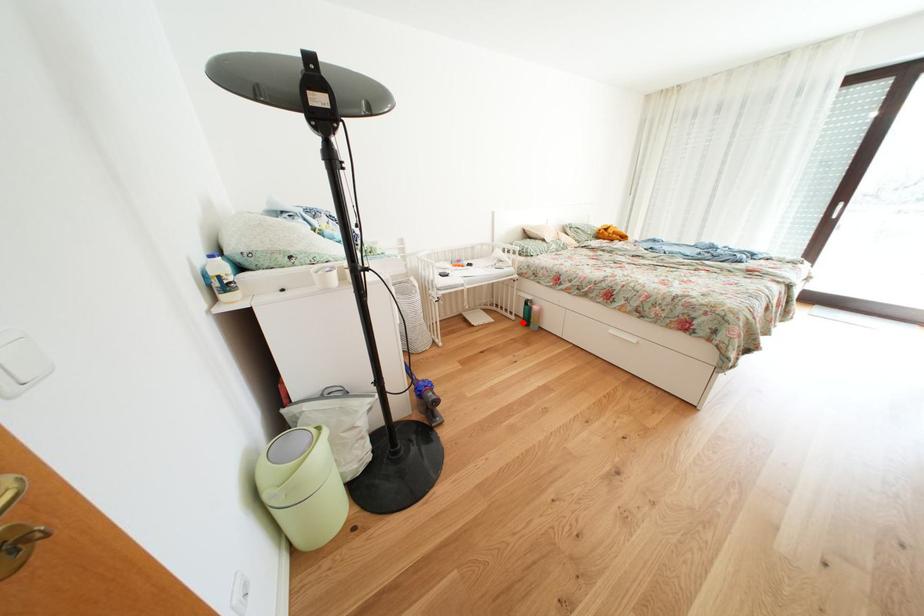
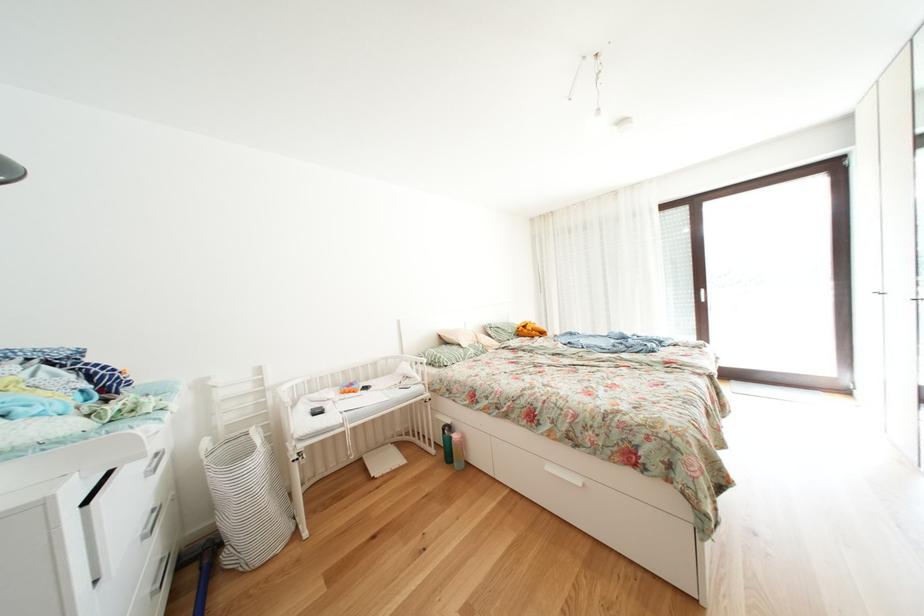
The point at the highlighted location is marked in the first image. Where is the corresponding point in the second image?

(443, 456)